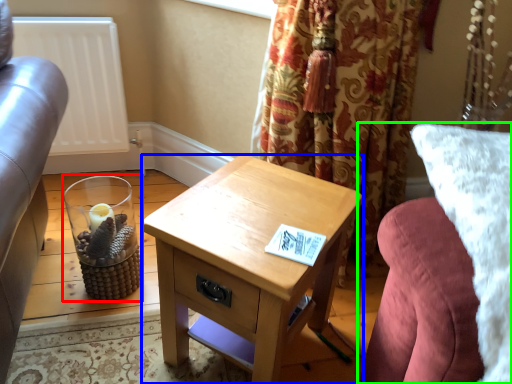
Question: Estimate the real-world distances between objects in this image. Which object is farther from candle holder (highlighted by a red box), nightstand (highlighted by a blue box) or studio couch (highlighted by a green box)?

Choices:
 (A) nightstand
 (B) studio couch

Answer: (B)